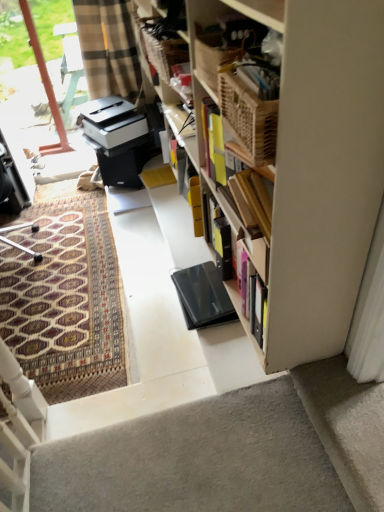
Question: Can you confirm if gray carpet at bottom right is positioned to the left of black matte laptop at center?

Choices:
 (A) yes
 (B) no

Answer: (B)

Question: Is gray carpet at bottom right shorter than black matte laptop at center?

Choices:
 (A) no
 (B) yes

Answer: (B)

Question: Considering the relative sizes of gray carpet at bottom right and black matte laptop at center in the image provided, is gray carpet at bottom right smaller than black matte laptop at center?

Choices:
 (A) no
 (B) yes

Answer: (B)

Question: Considering the relative sizes of gray carpet at bottom right and black matte laptop at center in the image provided, is gray carpet at bottom right thinner than black matte laptop at center?

Choices:
 (A) yes
 (B) no

Answer: (B)

Question: Is gray carpet at bottom right next to black matte laptop at center and touching it?

Choices:
 (A) yes
 (B) no

Answer: (B)

Question: Is black matte laptop at center bigger or smaller than transparent glass door at upper left?

Choices:
 (A) big
 (B) small

Answer: (B)

Question: From a real-world perspective, is black matte laptop at center above or below transparent glass door at upper left?

Choices:
 (A) below
 (B) above

Answer: (A)

Question: From the image's perspective, is black matte laptop at center located above or below transparent glass door at upper left?

Choices:
 (A) above
 (B) below

Answer: (B)

Question: Considering their positions, is black matte laptop at center located in front of or behind transparent glass door at upper left?

Choices:
 (A) behind
 (B) front

Answer: (B)

Question: In the image, is black matte laptop at center positioned in front of or behind patterned carpet at left?

Choices:
 (A) behind
 (B) front

Answer: (B)

Question: Is black matte laptop at center taller or shorter than patterned carpet at left?

Choices:
 (A) short
 (B) tall

Answer: (B)

Question: From the image's perspective, is black matte laptop at center positioned above or below patterned carpet at left?

Choices:
 (A) below
 (B) above

Answer: (A)

Question: Do you think black matte laptop at center is within patterned carpet at left, or outside of it?

Choices:
 (A) outside
 (B) inside

Answer: (A)

Question: From the image's perspective, is patterned carpet at left above or below white plastic printer at center?

Choices:
 (A) below
 (B) above

Answer: (A)

Question: In the image, is patterned carpet at left on the left side or the right side of white plastic printer at center?

Choices:
 (A) right
 (B) left

Answer: (B)